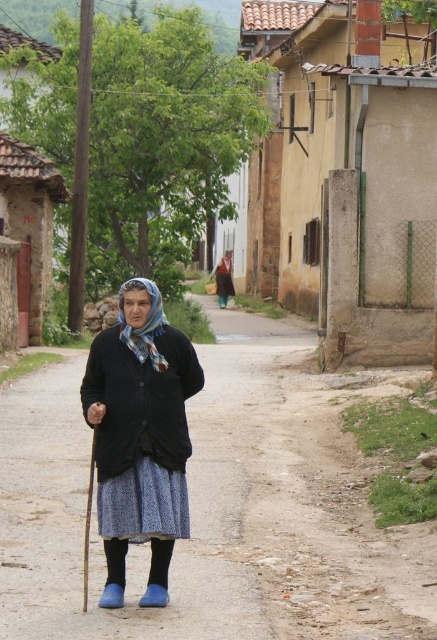
How distant is dirt road at center from matte black cardigan at center?

A distance of 6.06 meters exists between dirt road at center and matte black cardigan at center.

Can you confirm if dirt road at center is positioned below matte black cardigan at center?

Yes, dirt road at center is below matte black cardigan at center.

Is point (242, 545) positioned behind point (97, 413)?

Yes, point (242, 545) is farther from viewer.

At what (x,y) coordinates should I click in order to perform the action: click on dirt road at center. Please return your answer as a coordinate pair (x, y). This screenshot has width=437, height=640. Looking at the image, I should click on (218, 508).

Who is taller, black woolen sweater at center or matte black cardigan at center?

Standing taller between the two is black woolen sweater at center.

Does black woolen sweater at center have a lesser width compared to matte black cardigan at center?

No, black woolen sweater at center is not thinner than matte black cardigan at center.

This screenshot has height=640, width=437. Identify the location of black woolen sweater at center. (346, 188).

Is dirt road at center to the left of blue patterned scarf at center from the viewer's perspective?

Incorrect, dirt road at center is not on the left side of blue patterned scarf at center.

Is dirt road at center shorter than blue patterned scarf at center?

No.

Does point (76, 625) lie in front of point (148, 355)?

Yes, it is in front of point (148, 355).

Locate an element on the screen. This screenshot has width=437, height=640. dirt road at center is located at coordinates (218, 508).